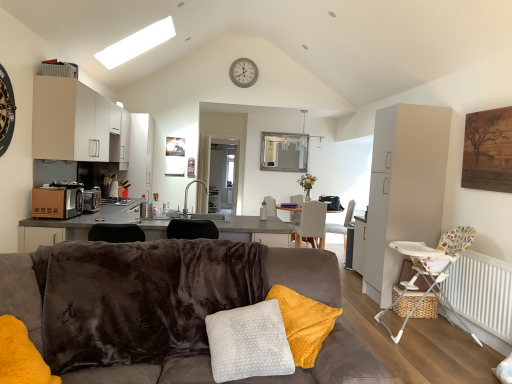
Locate an element on the screen. This screenshot has width=512, height=384. white ribbed radiator at lower right is located at coordinates (482, 292).

The height and width of the screenshot is (384, 512). What do you see at coordinates (311, 224) in the screenshot? I see `white fabric chair at center, which appears as the second chair when viewed from the back` at bounding box center [311, 224].

What do you see at coordinates (243, 72) in the screenshot? I see `white plastic clock at upper center` at bounding box center [243, 72].

At what (x,y) coordinates should I click in order to perform the action: click on white glossy bottle at center. Please return your answer as a coordinate pair (x, y). Looking at the image, I should click on (263, 211).

I want to click on white glossy armchair at center, so click(x=270, y=206).

Image resolution: width=512 pixels, height=384 pixels. Find the location of `white ribbed radiator at lower right`. white ribbed radiator at lower right is located at coordinates (482, 292).

Where is `appliance on the left side of velvet brown couch at lower right`? The image size is (512, 384). appliance on the left side of velvet brown couch at lower right is located at coordinates (117, 201).

Would you say matte black toaster at left is a long distance from velvet brown couch at lower right?

That's right, there is a large distance between matte black toaster at left and velvet brown couch at lower right.

Between white fabric chair at center, which appears as the second chair when viewed from the back, and silver metallic faucet at center, which one has more height?

Standing taller between the two is white fabric chair at center, which appears as the second chair when viewed from the back.

The width and height of the screenshot is (512, 384). In order to click on faucet above the white fabric chair at center, the 2th chair in the front-to-back sequence (from the image's perspective) in this screenshot , I will do `click(187, 193)`.

Does white fabric chair at center, the 2th chair in the front-to-back sequence, have a lesser width compared to silver metallic faucet at center?

Incorrect, the width of white fabric chair at center, the 2th chair in the front-to-back sequence, is not less than that of silver metallic faucet at center.

From the image's perspective, who appears lower, white fabric chair at center, the 2th chair in the front-to-back sequence, or silver metallic faucet at center?

white fabric chair at center, the 2th chair in the front-to-back sequence, appears lower in the image.

From a real-world perspective, which is physically above, metallic picnic basket at upper left or silver/glass mirror at upper center?

metallic picnic basket at upper left.

Who is more distant, metallic picnic basket at upper left or silver/glass mirror at upper center?

silver/glass mirror at upper center is more distant.

Can you tell me how much metallic picnic basket at upper left and silver/glass mirror at upper center differ in facing direction?

The angular difference between metallic picnic basket at upper left and silver/glass mirror at upper center is 89 degrees.

Based on the photo, is metallic picnic basket at upper left turned away from silver/glass mirror at upper center?

No, silver/glass mirror at upper center is not at the back of metallic picnic basket at upper left.

From the image's perspective, is metallic picnic basket at upper left positioned above or below light gray fabric chair at center, the third chair from the front?

Based on their image positions, metallic picnic basket at upper left is located above light gray fabric chair at center, the third chair from the front.

Can you confirm if metallic picnic basket at upper left is wider than light gray fabric chair at center, the third chair from the front?

In fact, metallic picnic basket at upper left might be narrower than light gray fabric chair at center, the third chair from the front.

Considering the points (55, 74) and (326, 225), which point is behind, point (55, 74) or point (326, 225)?

Positioned behind is point (326, 225).

What's the angular difference between metallic picnic basket at upper left and light gray fabric chair at center, the third chair from the front,'s facing directions?

The facing directions of metallic picnic basket at upper left and light gray fabric chair at center, the third chair from the front, are 180 degrees apart.

Measure the distance from velvet brown couch at lower right to white fabric chair at center, the 2th chair in the front-to-back sequence.

velvet brown couch at lower right is 4.00 meters from white fabric chair at center, the 2th chair in the front-to-back sequence.

Which object is wider, velvet brown couch at lower right or white fabric chair at center, which appears as the second chair when viewed from the back?

velvet brown couch at lower right.

How different are the orientations of velvet brown couch at lower right and white fabric chair at center, the 2th chair in the front-to-back sequence, in degrees?

176 degrees.

Considering the relative positions of velvet brown couch at lower right and white fabric chair at center, the 2th chair in the front-to-back sequence, in the image provided, is velvet brown couch at lower right to the right of white fabric chair at center, the 2th chair in the front-to-back sequence, from the viewer's perspective?

In fact, velvet brown couch at lower right is to the left of white fabric chair at center, the 2th chair in the front-to-back sequence.

Considering the positions of objects matte black toaster at left and white glossy bottle at center in the image provided, who is more to the right, matte black toaster at left or white glossy bottle at center?

white glossy bottle at center is more to the right.

Can you confirm if matte black toaster at left is shorter than white glossy bottle at center?

Yes.

Does point (119, 202) lie in front of point (261, 207)?

That is True.

In the image, is matte black toaster at left positioned in front of or behind white glossy bottle at center?

In the image, matte black toaster at left appears behind white glossy bottle at center.

Is matte brown microwave at left outside of metallic picnic basket at upper left?

matte brown microwave at left lies outside metallic picnic basket at upper left's area.

Which point is more forward, (39,188) or (77,66)?

Positioned in front is point (39,188).

Consider the image. Measure the distance from matte brown microwave at left to metallic picnic basket at upper left.

1.06 meters.

Is matte brown microwave at left beside metallic picnic basket at upper left?

No, matte brown microwave at left is not beside metallic picnic basket at upper left.

This screenshot has width=512, height=384. Find the location of `appliance on the left of velvet brown couch at lower right`. appliance on the left of velvet brown couch at lower right is located at coordinates (117, 201).

You are a GUI agent. You are given a task and a screenshot of the screen. Output one action in this format:
    pyautogui.click(x=<x>, y=<y>)
    Task: Click on the faucet in front of the white fabric chair at center, which appears as the second chair when viewed from the back
    This screenshot has height=384, width=512.
    Given the screenshot: What is the action you would take?
    pyautogui.click(x=187, y=193)

From the image, which object appears to be nearer to white matte cabinet at upper left, arranged as the second cabinetry when viewed from the right, white fabric chair at center, which appears as the second chair when viewed from the back, or metallic picnic basket at upper left?

metallic picnic basket at upper left lies closer to white matte cabinet at upper left, arranged as the second cabinetry when viewed from the right, than the other object.

Looking at the image, which one is located closer to metallic picnic basket at upper left, white plastic clock at upper center or white plastic highchair at lower right, which is counted as the third chair, starting from the back?

white plastic clock at upper center is closer to metallic picnic basket at upper left.

From the image, which object appears to be nearer to silver metallic faucet at center, matte black toaster at left or white plastic highchair at lower right, placed as the 1th chair when sorted from front to back?

matte black toaster at left.

Estimate the real-world distances between objects in this image. Which object is closer to metallic picnic basket at upper left, white plastic clock at upper center or velvet brown couch at lower right?

The object closer to metallic picnic basket at upper left is white plastic clock at upper center.

Consider the image. Estimate the real-world distances between objects in this image. Which object is further from metallic picnic basket at upper left, white plastic highchair at lower right, placed as the 1th chair when sorted from front to back, or white glossy armchair at center?

white glossy armchair at center.

Looking at this image, considering their positions, is silver/glass mirror at upper center positioned closer to white glossy armchair at center than white fabric chair at center, which appears as the second chair when viewed from the back?

Among the two, white fabric chair at center, which appears as the second chair when viewed from the back, is located nearer to white glossy armchair at center.

Looking at the image, which one is located closer to white glossy bottle at center, velvet brown couch at lower right or white matte cabinet at upper left, arranged as the second cabinetry when viewed from the right?

white matte cabinet at upper left, arranged as the second cabinetry when viewed from the right.

From the picture: Looking at the image, which one is located closer to white matte cabinet at right, which ranks as the second cabinetry in left-to-right order, white fabric chair at center, which appears as the second chair when viewed from the back, or white glossy bottle at center?

white fabric chair at center, which appears as the second chair when viewed from the back, lies closer to white matte cabinet at right, which ranks as the second cabinetry in left-to-right order, than the other object.

You are a GUI agent. You are given a task and a screenshot of the screen. Output one action in this format:
    pyautogui.click(x=<x>, y=<y>)
    Task: Click on the faucet between white ribbed radiator at lower right and silver/glass mirror at upper center from front to back
    Image resolution: width=512 pixels, height=384 pixels.
    Given the screenshot: What is the action you would take?
    pyautogui.click(x=187, y=193)

Where is `kitchen appliance between white textured pillow at center and white glossy armchair at center along the z-axis`? The height and width of the screenshot is (384, 512). kitchen appliance between white textured pillow at center and white glossy armchair at center along the z-axis is located at coordinates (57, 202).

You are a GUI agent. You are given a task and a screenshot of the screen. Output one action in this format:
    pyautogui.click(x=<x>, y=<y>)
    Task: Click on the studio couch between matte brown microwave at left and white matte cabinet at right, which ranks as the second cabinetry in left-to-right order
    This screenshot has width=512, height=384.
    Given the screenshot: What is the action you would take?
    pyautogui.click(x=147, y=301)

Where is `studio couch situated between metallic picnic basket at upper left and white matte cabinet at right, which appears as the 1th cabinetry when viewed from the right, from left to right`? The height and width of the screenshot is (384, 512). studio couch situated between metallic picnic basket at upper left and white matte cabinet at right, which appears as the 1th cabinetry when viewed from the right, from left to right is located at coordinates (147, 301).